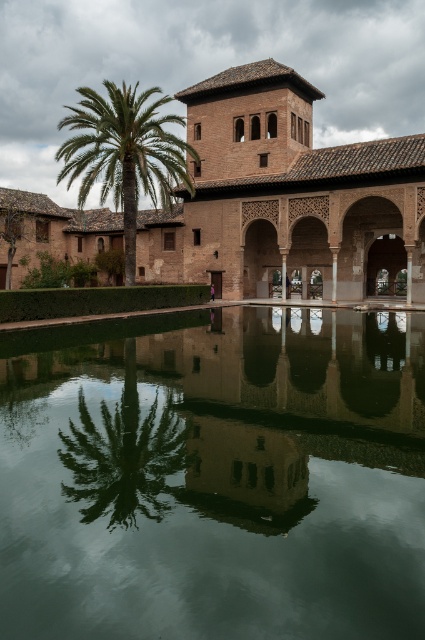
Question: Is brown clay palace at center below green leafy palm at center?

Choices:
 (A) yes
 (B) no

Answer: (A)

Question: From the image, what is the correct spatial relationship of green reflective water at center in relation to green leafy palm at center?

Choices:
 (A) right
 (B) left

Answer: (A)

Question: Which object is closer to the camera taking this photo?

Choices:
 (A) brown clay palace at center
 (B) green reflective water at center
 (C) green leafy palm at center

Answer: (B)

Question: Which point is closer to the camera?

Choices:
 (A) green reflective water at center
 (B) brown clay palace at center
 (C) green leafy palm at center

Answer: (A)

Question: Which point is farther to the camera?

Choices:
 (A) (163, 147)
 (B) (31, 502)

Answer: (A)

Question: Does brown clay palace at center appear over green leafy palm at center?

Choices:
 (A) no
 (B) yes

Answer: (A)